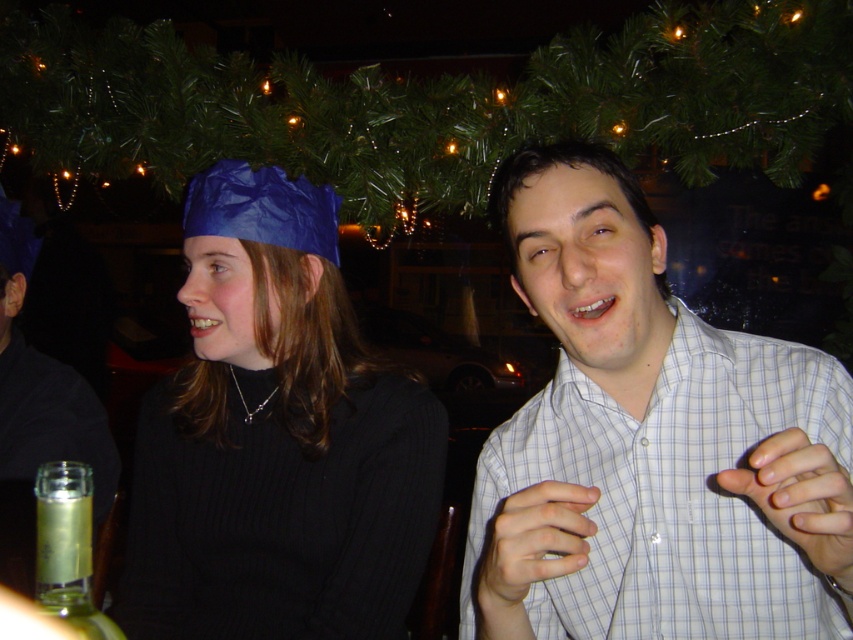
Can you confirm if white checkered shirt at center is shorter than clear glass bottle at lower left?

Incorrect, white checkered shirt at center's height does not fall short of clear glass bottle at lower left's.

Who is lower down, white checkered shirt at center or clear glass bottle at lower left?

clear glass bottle at lower left is lower down.

Who is more forward, (612,438) or (38,602)?

Point (38,602) is more forward.

This screenshot has width=853, height=640. Identify the location of white checkered shirt at center. point(650,442).

Between point (595, 508) and point (306, 292), which one is positioned in front?

Positioned in front is point (595, 508).

Is white checkered shirt at center to the right of matte blue paper hat at upper left from the viewer's perspective?

Yes, white checkered shirt at center is to the right of matte blue paper hat at upper left.

Describe the element at coordinates (650, 442) in the screenshot. This screenshot has width=853, height=640. I see `white checkered shirt at center` at that location.

Locate an element on the screen. The height and width of the screenshot is (640, 853). white checkered shirt at center is located at coordinates (650, 442).

From the picture: Is matte black shirt at center smaller than clear glass bottle at lower left?

Incorrect, matte black shirt at center is not smaller in size than clear glass bottle at lower left.

Can you confirm if matte black shirt at center is bigger than clear glass bottle at lower left?

Yes.

In the scene shown: Measure the distance between point [51,440] and camera.

Point [51,440] is 1.24 meters away from camera.

Locate an element on the screen. matte black shirt at center is located at coordinates click(38, 412).